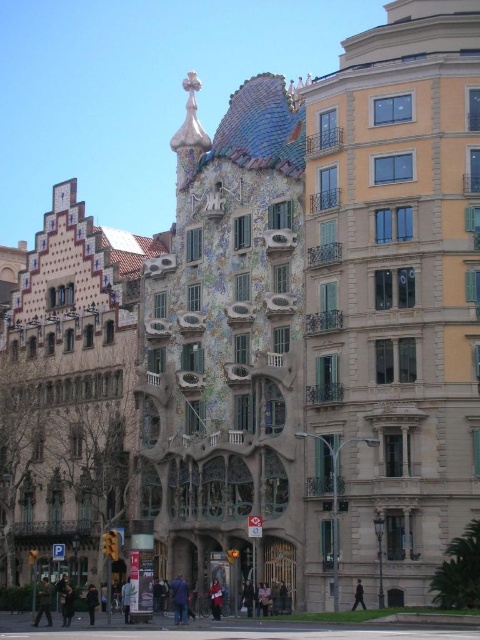
Question: Is red fabric coat at center behind dark brown leather coat at lower center?

Choices:
 (A) yes
 (B) no

Answer: (A)

Question: Estimate the real-world distances between objects in this image. Which object is closer to the dark brown leather coat at lower center?

Choices:
 (A) dark blue jacket at center
 (B) dark gray pants at lower left
 (C) dark brown leather jacket at lower left

Answer: (C)

Question: Which object appears closest to the camera in this image?

Choices:
 (A) dark brown leather jacket at lower center
 (B) dark brown leather jacket at lower left
 (C) dark blue jacket at center

Answer: (C)

Question: Is dark blue jeans at center to the left of black fabric coat at center from the viewer's perspective?

Choices:
 (A) no
 (B) yes

Answer: (B)

Question: Based on their relative distances, which object is farther from the dark gray pants at lower left?

Choices:
 (A) dark brown leather jacket at lower center
 (B) dark blue jeans at center

Answer: (B)

Question: Considering the relative positions of dark blue jacket at center and dark brown leather jacket at lower left in the image provided, where is dark blue jacket at center located with respect to dark brown leather jacket at lower left?

Choices:
 (A) above
 (B) below

Answer: (A)